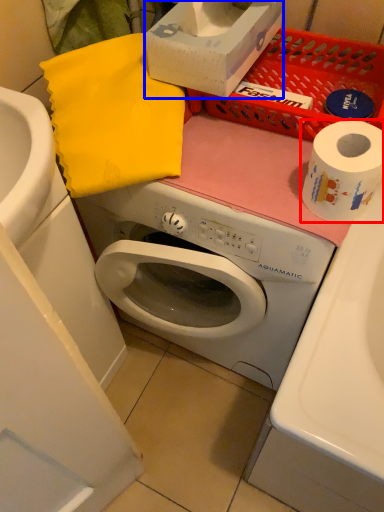
Question: Which object is closer to the camera taking this photo, toilet paper (highlighted by a red box) or box (highlighted by a blue box)?

Choices:
 (A) toilet paper
 (B) box

Answer: (A)